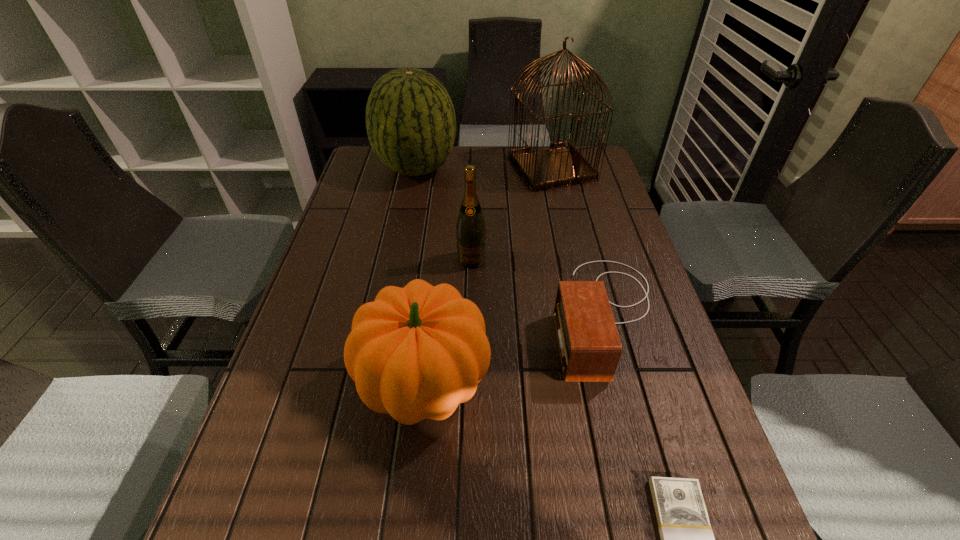
This screenshot has height=540, width=960. What are the coordinates of `the tallest object` in the screenshot? It's located at (563, 165).

Locate an element on the screen. This screenshot has width=960, height=540. watermelon is located at coordinates (410, 119).

You are a GUI agent. You are given a task and a screenshot of the screen. Output one action in this format:
    pyautogui.click(x=<x>, y=<y>)
    Task: Click on the third tallest object
    Image resolution: width=960 pixels, height=540 pixels.
    Given the screenshot: What is the action you would take?
    pyautogui.click(x=470, y=228)

What are the coordinates of `the fourth tallest object` in the screenshot? It's located at (416, 352).

The image size is (960, 540). What are the coordinates of `radio receiver` in the screenshot? It's located at (589, 346).

Locate an element on the screen. vacant space located on the front of the birdcage is located at coordinates (573, 263).

Where is `blank space located on the right of the watermelon`? blank space located on the right of the watermelon is located at coordinates (544, 168).

At what (x,y) coordinates should I click in order to perform the action: click on vacant space located on the front-facing side of the wine bottle. Please return your answer as a coordinate pair (x, y). The image size is (960, 540). Looking at the image, I should click on (470, 301).

The width and height of the screenshot is (960, 540). What are the coordinates of `free space located on the right of the pumpkin` in the screenshot? It's located at (546, 383).

Where is `free space located 0.230m on the front-facing side of the second shortest object`? The width and height of the screenshot is (960, 540). free space located 0.230m on the front-facing side of the second shortest object is located at coordinates (458, 315).